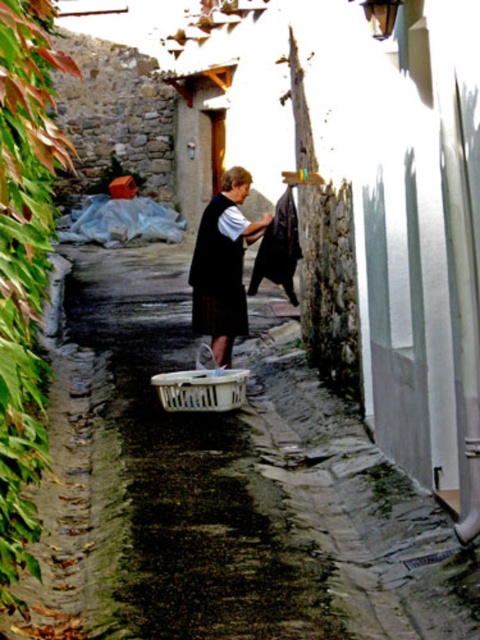
You are helping someone hang laundry in the alleyway. You have a dark blue fabric dress at center and a white plastic basket at center. Which item requires more space to hang properly?

The dark blue fabric dress at center requires more space to hang properly because it has a larger size compared to the white plastic basket at center.

You are a delivery person with a box that is 90 centimeters wide. You need to navigate through the narrow alleyway and pass between the matte black vest at center and the white plastic basket at center. Can your box fit through the space between them without touching either object?

The distance between the matte black vest at center and the white plastic basket at center is 89.19 centimeters. Since the box is 90 centimeters wide, it is slightly wider than the available space. Therefore, the box cannot fit through the space between them without touching either object.